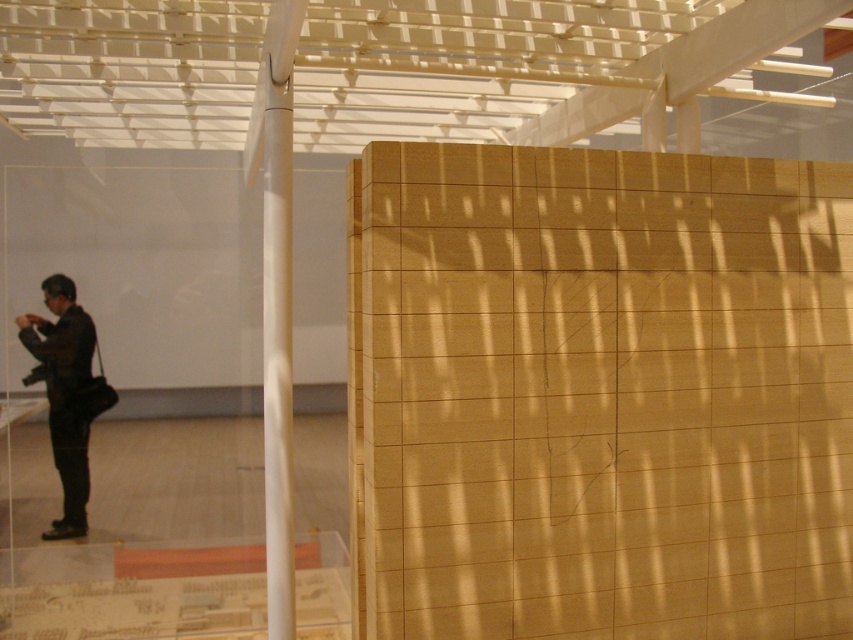
Who is more forward, (276, 278) or (61, 429)?

Point (276, 278) is more forward.

Is point (289, 51) farther from camera compared to point (36, 324)?

No.

Which is behind, point (276, 333) or point (51, 332)?

The point (51, 332) is behind.

Image resolution: width=853 pixels, height=640 pixels. Find the location of `white smooth pole at center`. white smooth pole at center is located at coordinates (276, 298).